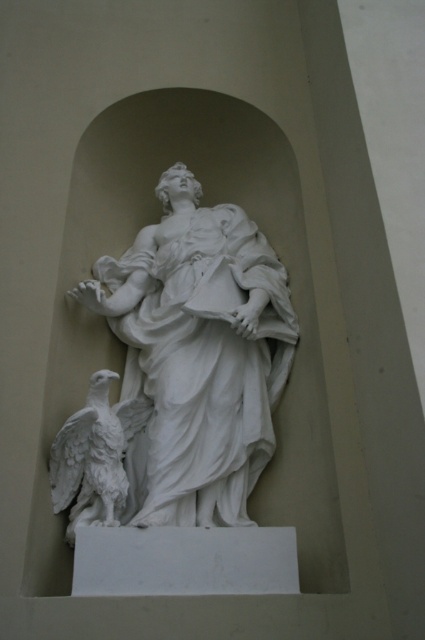
Question: Is white marble statue at center below white marble eagle at lower left?

Choices:
 (A) no
 (B) yes

Answer: (A)

Question: Does white marble statue at center come behind white marble eagle at lower left?

Choices:
 (A) yes
 (B) no

Answer: (B)

Question: Is white marble statue at center below white marble eagle at lower left?

Choices:
 (A) yes
 (B) no

Answer: (B)

Question: Which point is farther to the camera?

Choices:
 (A) white marble statue at center
 (B) white marble eagle at lower left

Answer: (B)